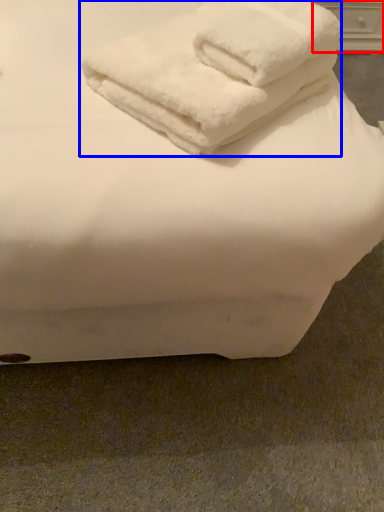
Question: Among these objects, which one is farthest to the camera, drawer (highlighted by a red box) or towel (highlighted by a blue box)?

Choices:
 (A) drawer
 (B) towel

Answer: (A)